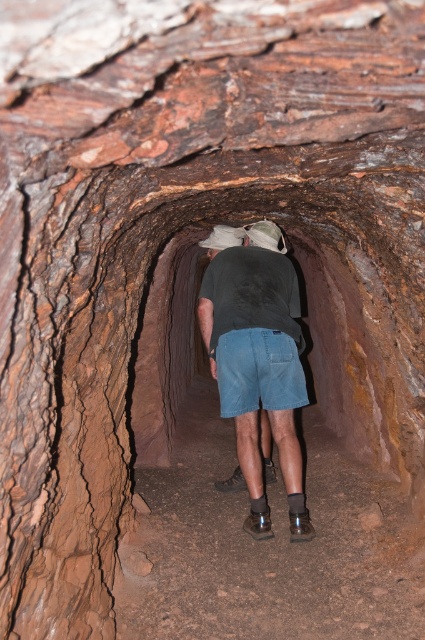
Question: Is dark gray t-shirt at center smaller than denim shorts at center?

Choices:
 (A) yes
 (B) no

Answer: (B)

Question: Observing the image, what is the correct spatial positioning of dark gray t-shirt at center in reference to denim shorts at center?

Choices:
 (A) above
 (B) below

Answer: (B)

Question: Which point is farther from the camera taking this photo?

Choices:
 (A) (257, 381)
 (B) (229, 340)

Answer: (A)

Question: Can you confirm if dark gray t-shirt at center is positioned below denim shorts at center?

Choices:
 (A) no
 (B) yes

Answer: (B)